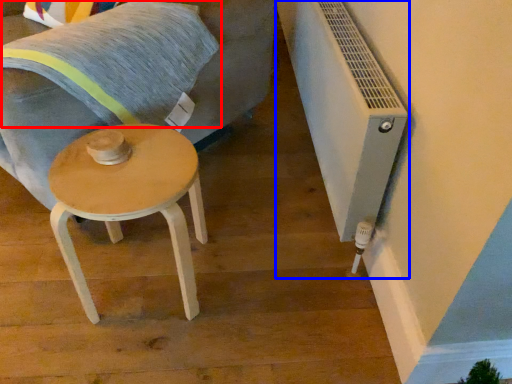
Question: Which point is closer to the camera, pillow (highlighted by a red box) or air conditioning (highlighted by a blue box)?

Choices:
 (A) pillow
 (B) air conditioning

Answer: (B)